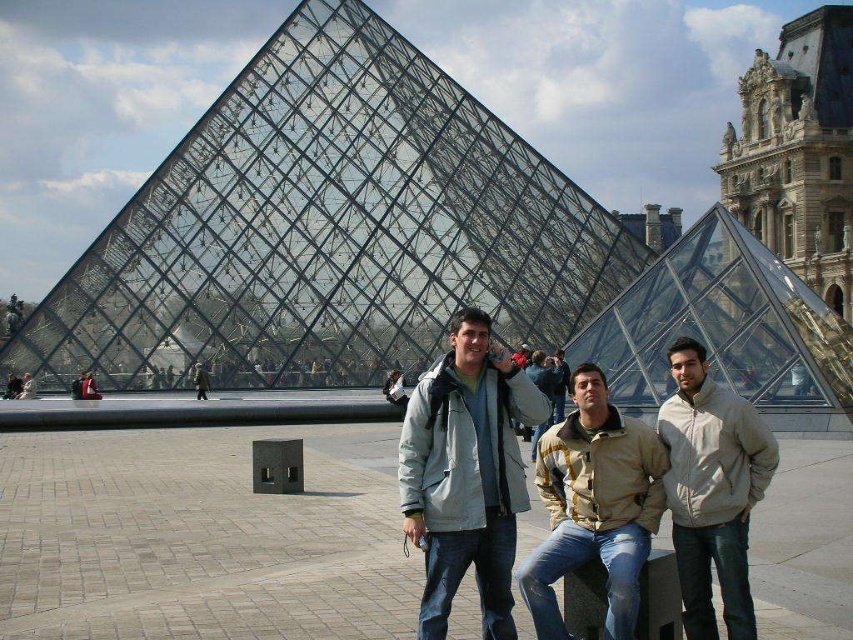
You are a photographer trying to capture both the light gray jacket at center and the beige fabric jacket at center in a single frame. Given their height difference, which jacket will appear larger in the photo?

The light gray jacket at center will appear larger in the photo because it is taller than the beige fabric jacket at center.